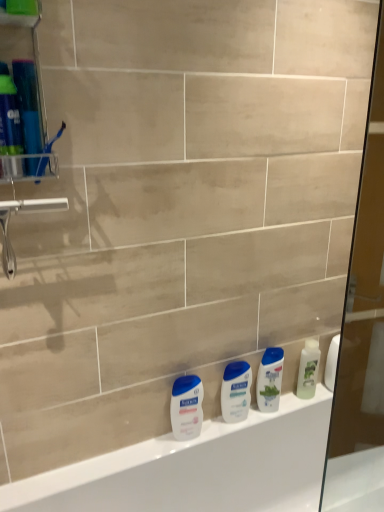
You are a GUI agent. You are given a task and a screenshot of the screen. Output one action in this format:
    pyautogui.click(x=<x>, y=<y>)
    Task: Click on the vacant space to the right of white glossy shampoo at center, acting as the 1th cleaning product starting from the left
    Image resolution: width=384 pixels, height=512 pixels.
    Given the screenshot: What is the action you would take?
    coord(303,403)